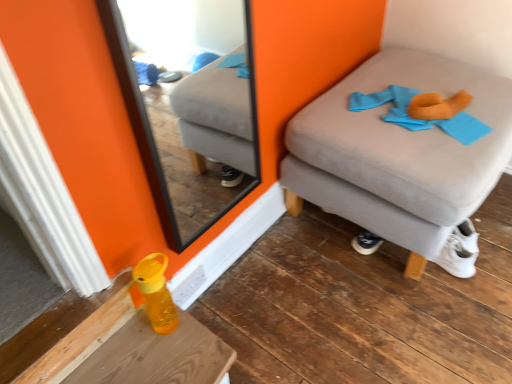
Where is `free space in front of translucent yellow bottle at lower left`? free space in front of translucent yellow bottle at lower left is located at coordinates (165, 360).